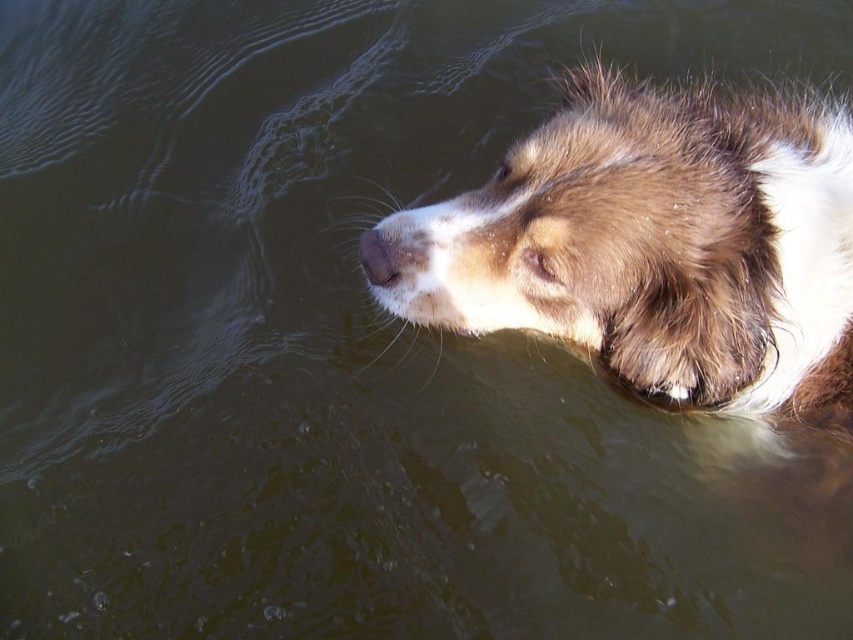
You are a photographer trying to capture a clear photo of the brown fuzzy dog at upper center and the brown matte nose at upper center. Which object should you focus on first to ensure both are in focus?

You should focus on the brown fuzzy dog at upper center first because it is closer to the viewer than the brown matte nose at upper center, so adjusting focus from the closer object to the farther one will help both be in focus.

You are standing at the point labeled point (625, 124) and want to throw a ball to a friend who is 4 feet away from you. Can you reach your friend by throwing the ball 4 feet?

The distance between you and your friend is 4 feet, and you can throw the ball 4 feet, so yes, you can reach your friend by throwing the ball 4 feet.